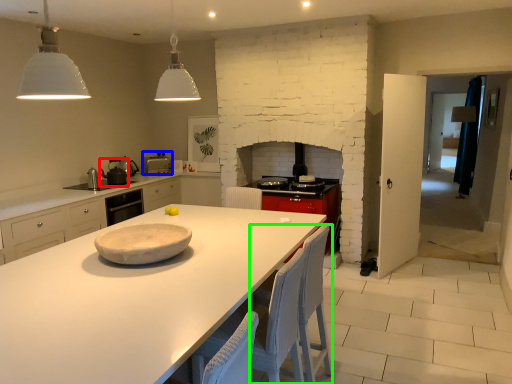
Question: Which is farther away from appliance (highlighted by a red box)? appliance (highlighted by a blue box) or chair (highlighted by a green box)?

Choices:
 (A) appliance
 (B) chair

Answer: (B)